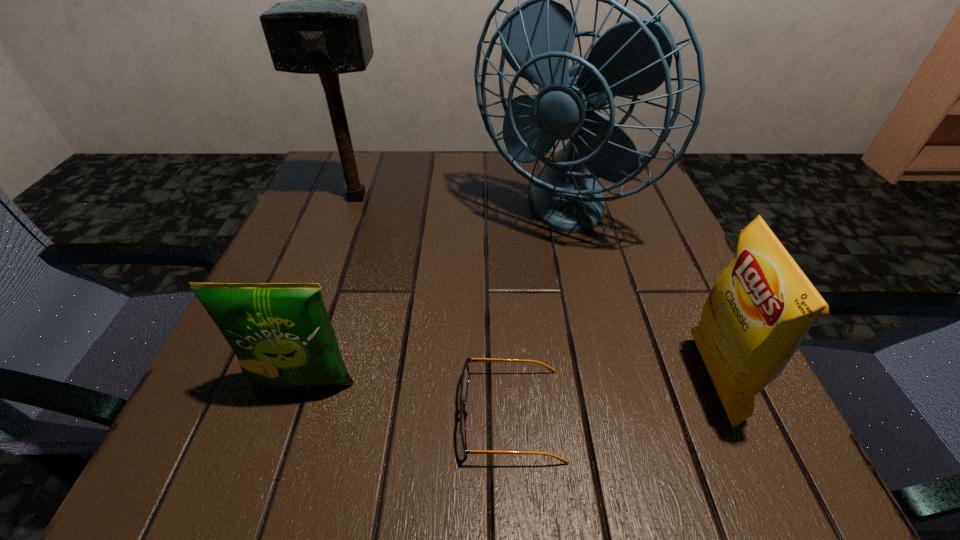
Where is `fan`? The width and height of the screenshot is (960, 540). fan is located at coordinates point(633,57).

Find the location of `the fourth shortest object`. the fourth shortest object is located at coordinates (319, 33).

Find the location of `the right crisp (potato chip)`. the right crisp (potato chip) is located at coordinates (759, 310).

Where is `the fourth tallest object`? the fourth tallest object is located at coordinates (281, 333).

Locate an element on the screen. The height and width of the screenshot is (540, 960). the shorter crisp (potato chip) is located at coordinates pos(281,333).

Locate an element on the screen. spectacles is located at coordinates (465, 377).

You are a GUI agent. You are given a task and a screenshot of the screen. Output one action in this format:
    pyautogui.click(x=<x>, y=<y>)
    Task: Click on the free space located 0.230m in front of the fan to blow air
    This screenshot has width=960, height=540.
    Given the screenshot: What is the action you would take?
    pyautogui.click(x=587, y=364)

This screenshot has height=540, width=960. Find the location of `free space located 0.200m on the right of the mallet`. free space located 0.200m on the right of the mallet is located at coordinates (483, 198).

Locate an element on the screen. The image size is (960, 540). vacant space located on the front of the right crisp (potato chip) with the logo is located at coordinates (660, 381).

Locate an element on the screen. vacant region located on the front of the right crisp (potato chip) with the logo is located at coordinates (444, 381).